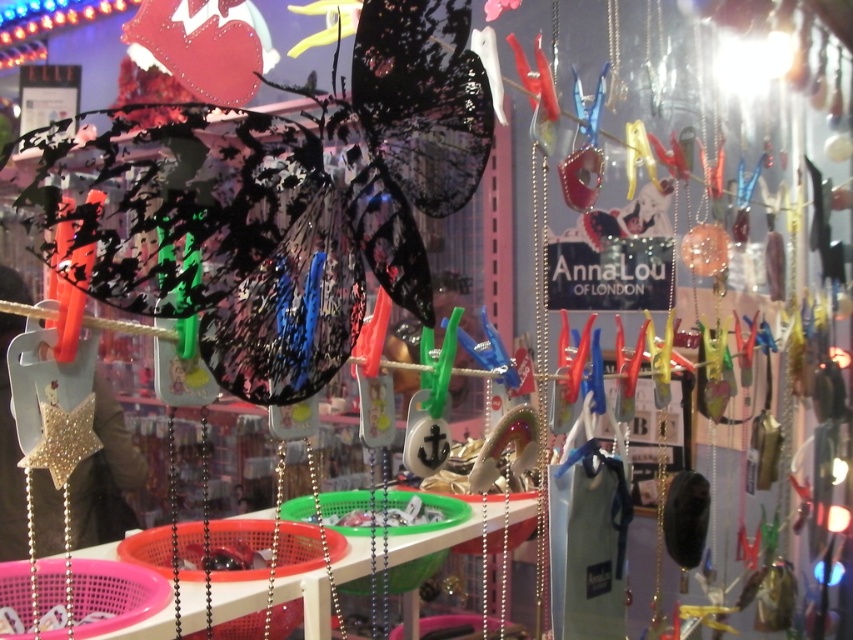
Can you confirm if transparent glossy butterfly at center is taller than silver metallic chain at center?

Correct, transparent glossy butterfly at center is much taller as silver metallic chain at center.

The width and height of the screenshot is (853, 640). What do you see at coordinates (363, 205) in the screenshot? I see `transparent glossy butterfly at center` at bounding box center [363, 205].

What do you see at coordinates (363, 205) in the screenshot? I see `transparent glossy butterfly at center` at bounding box center [363, 205].

In order to click on transparent glossy butterfly at center in this screenshot , I will do point(363,205).